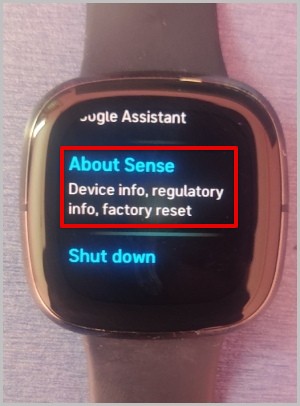
The image size is (300, 406). What are the coordinates of `screen` in the screenshot? It's located at (209, 169).